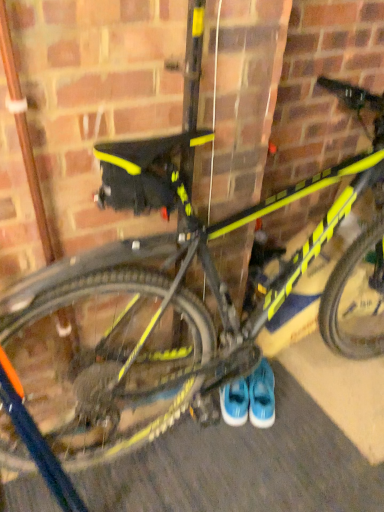
Question: Can we say blue suede sneakers at center, which ranks as the 2th footwear in right-to-left order, lies outside rubberized asphalt at lower center?

Choices:
 (A) no
 (B) yes

Answer: (B)

Question: Can you confirm if blue suede sneakers at center, which is the first footwear in left-to-right order, is thinner than rubberized asphalt at lower center?

Choices:
 (A) no
 (B) yes

Answer: (B)

Question: Could you tell me if blue suede sneakers at center, which is the first footwear in left-to-right order, is turned towards rubberized asphalt at lower center?

Choices:
 (A) yes
 (B) no

Answer: (B)

Question: From a real-world perspective, is blue suede sneakers at center, which is the first footwear in left-to-right order, physically above rubberized asphalt at lower center?

Choices:
 (A) yes
 (B) no

Answer: (A)

Question: Can you confirm if blue suede sneakers at center, which ranks as the 2th footwear in right-to-left order, is smaller than rubberized asphalt at lower center?

Choices:
 (A) yes
 (B) no

Answer: (A)

Question: Does blue suede sneakers at center, which is the first footwear in left-to-right order, appear on the right side of rubberized asphalt at lower center?

Choices:
 (A) yes
 (B) no

Answer: (B)

Question: From a real-world perspective, is rubberized asphalt at lower center located higher than blue suede sneakers at center, which ranks as the second footwear in left-to-right order?

Choices:
 (A) yes
 (B) no

Answer: (B)

Question: Considering the relative sizes of rubberized asphalt at lower center and blue suede sneakers at center, which ranks as the second footwear in left-to-right order, in the image provided, is rubberized asphalt at lower center bigger than blue suede sneakers at center, which ranks as the second footwear in left-to-right order,?

Choices:
 (A) yes
 (B) no

Answer: (A)

Question: Is blue suede sneakers at center, which ranks as the second footwear in left-to-right order, completely or partially inside rubberized asphalt at lower center?

Choices:
 (A) yes
 (B) no

Answer: (B)

Question: Is blue suede sneakers at center, which ranks as the second footwear in left-to-right order, at the back of rubberized asphalt at lower center?

Choices:
 (A) no
 (B) yes

Answer: (A)

Question: Is rubberized asphalt at lower center aimed at blue suede sneakers at center, the 1th footwear positioned from the right?

Choices:
 (A) no
 (B) yes

Answer: (A)

Question: Is rubberized asphalt at lower center further to the viewer compared to blue suede sneakers at center, which ranks as the second footwear in left-to-right order?

Choices:
 (A) no
 (B) yes

Answer: (A)

Question: Would you say blue suede sneakers at center, which ranks as the second footwear in left-to-right order, is outside blue suede sneakers at center, which ranks as the 2th footwear in right-to-left order?

Choices:
 (A) yes
 (B) no

Answer: (A)